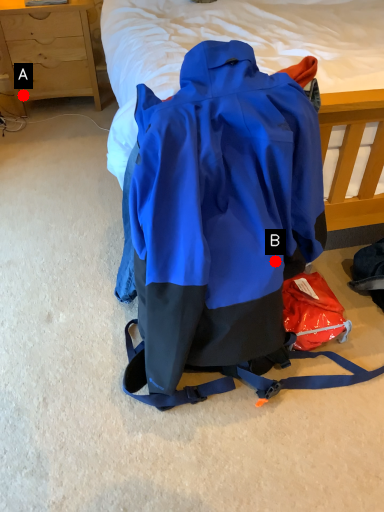
Question: Two points are circled on the image, labeled by A and B beside each circle. Which point is closer to the camera taking this photo?

Choices:
 (A) A is closer
 (B) B is closer

Answer: (B)